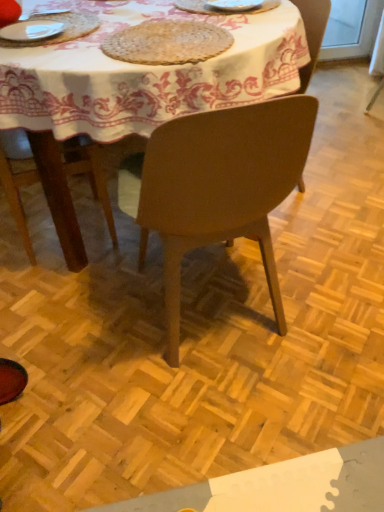
Question: Is white fabric tablecloth at center thinner than woven natural fiber mat at upper center?

Choices:
 (A) no
 (B) yes

Answer: (A)

Question: Is white fabric tablecloth at center at the left side of woven natural fiber mat at upper center?

Choices:
 (A) yes
 (B) no

Answer: (A)

Question: Is white fabric tablecloth at center positioned with its back to woven natural fiber mat at upper center?

Choices:
 (A) yes
 (B) no

Answer: (B)

Question: Is white fabric tablecloth at center shorter than woven natural fiber mat at upper center?

Choices:
 (A) yes
 (B) no

Answer: (B)

Question: Is white fabric tablecloth at center taller than woven natural fiber mat at upper center?

Choices:
 (A) no
 (B) yes

Answer: (B)

Question: In terms of width, does white ceramic plate at upper center look wider or thinner when compared to white glossy plate at upper left?

Choices:
 (A) thin
 (B) wide

Answer: (A)

Question: Is white ceramic plate at upper center bigger or smaller than white glossy plate at upper left?

Choices:
 (A) small
 (B) big

Answer: (A)

Question: Do you think white ceramic plate at upper center is within white glossy plate at upper left, or outside of it?

Choices:
 (A) inside
 (B) outside

Answer: (B)

Question: In the image, is white ceramic plate at upper center positioned in front of or behind white glossy plate at upper left?

Choices:
 (A) behind
 (B) front

Answer: (A)

Question: Based on their sizes in the image, would you say matte brown chair at center, marked as the first chair in a front-to-back arrangement, is bigger or smaller than matte brown chair at center, the second chair from the front?

Choices:
 (A) small
 (B) big

Answer: (B)

Question: Is matte brown chair at center, which ranks as the 2th chair in back-to-front order, situated inside matte brown chair at center, the second chair from the front, or outside?

Choices:
 (A) outside
 (B) inside

Answer: (A)

Question: From the image's perspective, is matte brown chair at center, marked as the first chair in a front-to-back arrangement, located above or below matte brown chair at center, which ranks as the 1th chair in back-to-front order?

Choices:
 (A) below
 (B) above

Answer: (A)

Question: Looking at their shapes, would you say matte brown chair at center, marked as the first chair in a front-to-back arrangement, is wider or thinner than matte brown chair at center, which ranks as the 1th chair in back-to-front order?

Choices:
 (A) wide
 (B) thin

Answer: (A)

Question: Considering the positions of point (249, 10) and point (244, 57), is point (249, 10) closer or farther from the camera than point (244, 57)?

Choices:
 (A) farther
 (B) closer

Answer: (A)

Question: From their relative heights in the image, would you say white ceramic plate at upper center is taller or shorter than white fabric tablecloth at center?

Choices:
 (A) tall
 (B) short

Answer: (B)